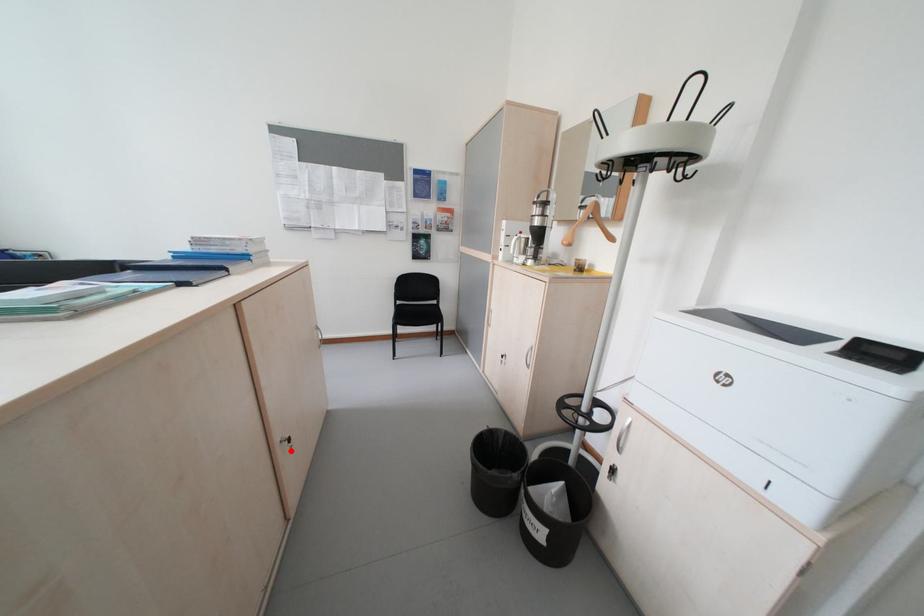
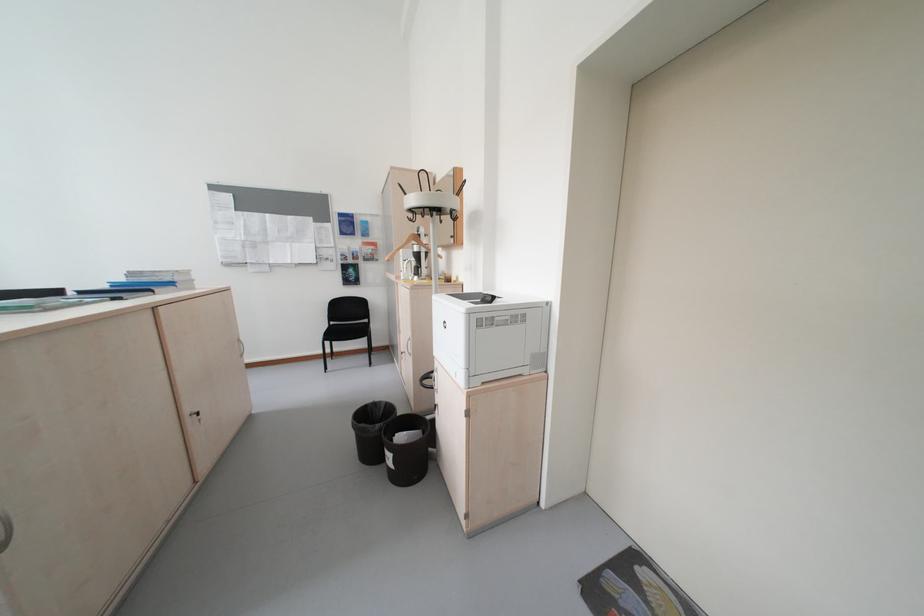
Question: A red point is marked in image1. In image2, is the corresponding 3D point closer to the camera or farther? Reply with the corresponding letter.

Choices:
 (A) The corresponding 3D point is closer.
 (B) The corresponding 3D point is farther.

Answer: (B)